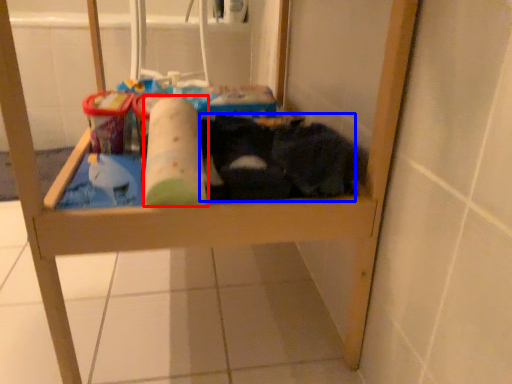
Question: Which point is closer to the camera, toilet paper (highlighted by a red box) or laundry (highlighted by a blue box)?

Choices:
 (A) toilet paper
 (B) laundry

Answer: (A)